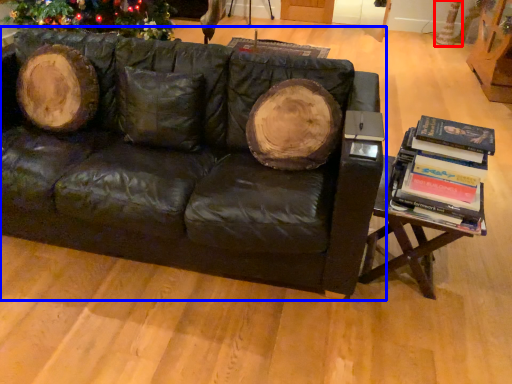
Question: Among these objects, which one is nearest to the camera, tree trunk (highlighted by a red box) or studio couch (highlighted by a blue box)?

Choices:
 (A) tree trunk
 (B) studio couch

Answer: (B)